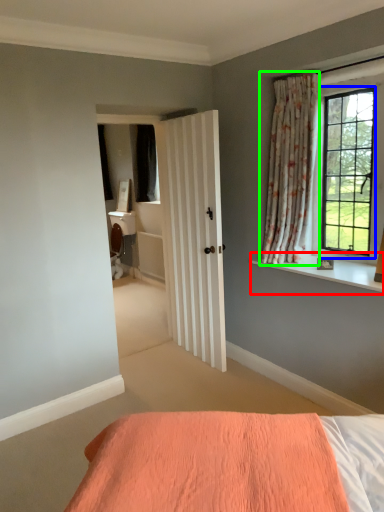
Question: Considering the real-world distances, which object is farthest from window sill (highlighted by a red box)? window (highlighted by a blue box) or curtain (highlighted by a green box)?

Choices:
 (A) window
 (B) curtain

Answer: (B)